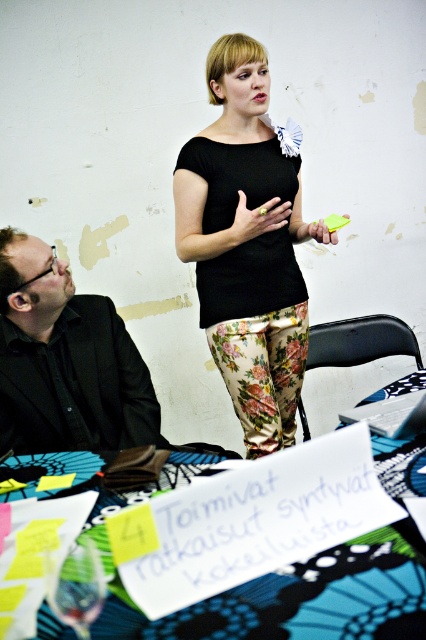
Question: Which of the following is the closest to the observer?

Choices:
 (A) (293, 224)
 (B) (65, 605)
 (C) (276, 611)
 (D) (45, 444)

Answer: (C)

Question: Estimate the real-world distances between objects in this image. Which object is farther from the blue printed fabric table at lower center?

Choices:
 (A) black shirt at left
 (B) black matte shirt at center
 (C) transparent glass at lower left

Answer: (B)

Question: Does black matte shirt at center appear over blue printed fabric table at lower center?

Choices:
 (A) no
 (B) yes

Answer: (B)

Question: Does blue printed fabric table at lower center have a smaller size compared to transparent glass at lower left?

Choices:
 (A) yes
 (B) no

Answer: (B)

Question: Does black matte shirt at center have a greater width compared to black shirt at left?

Choices:
 (A) no
 (B) yes

Answer: (B)

Question: Which point is farther from the camera taking this photo?

Choices:
 (A) (157, 486)
 (B) (77, 557)
 (C) (259, 428)
 (D) (55, 429)

Answer: (C)